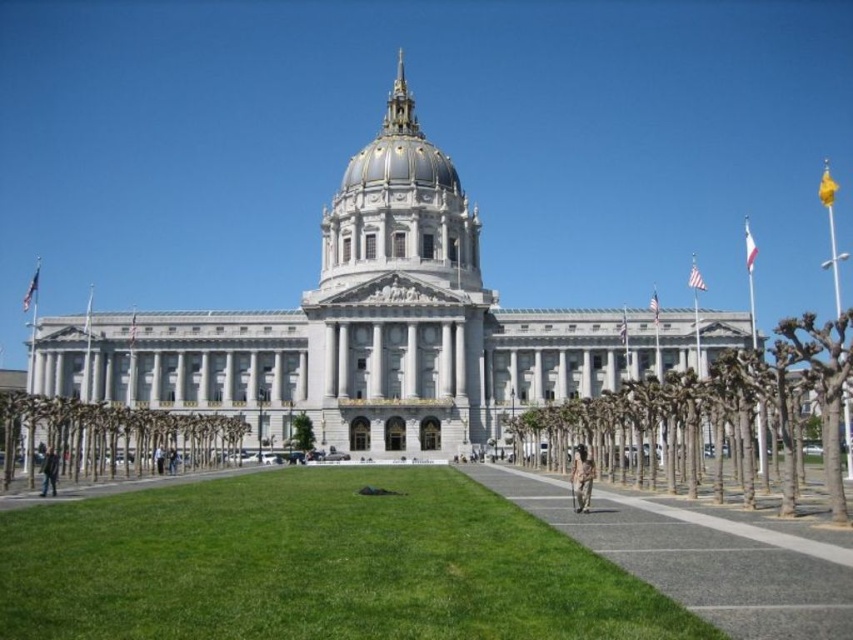
Looking at this image, you are an architect visiting this building and want to plant a new tree in the front yard. The existing trees include a bare branches at center and a green leafy tree at center. Which tree should you choose as a reference for height if you want to plant a tree that will grow to be taller than both?

The bare branches at center is much taller than the green leafy tree at center, so you should choose the bare branches at center as a reference to ensure the new tree will grow taller than both.

You are a gardener planning to plant a new tree in the area between the bare branches at center and the green leafy tree at lower left. Considering the existing trees, which tree should you use as a reference for spacing to ensure proper growth? Explain your reasoning.

The bare branches at center has a larger size compared to the green leafy tree at lower left. Therefore, you should use the bare branches at center as the reference for spacing to ensure there is enough room for the new tree to grow properly.

You are a landscape architect designing a new garden. You have to place a new statue that requires a large open space. Which area between the green grass at center and the green leafy tree at lower left would you choose and why?

You should choose the green leafy tree at lower left because it occupies more space than the green grass at center, providing a larger area for the statue.